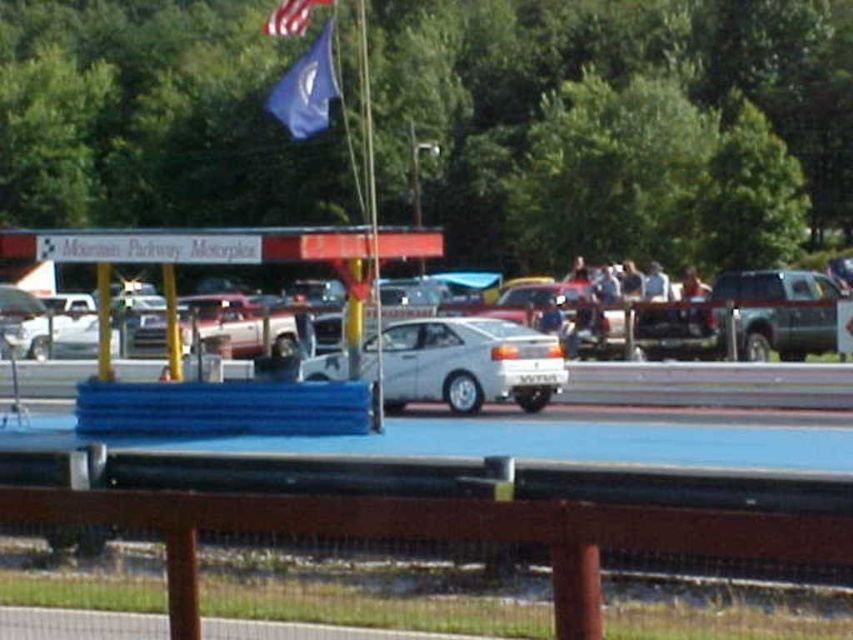
Who is lower down, metallic flag pole at center or american flag at upper center?

Positioned lower is metallic flag pole at center.

The image size is (853, 640). I want to click on metallic flag pole at center, so click(368, 168).

Is point (370, 282) positioned behind point (299, 20)?

No, it is not.

Identify the location of metallic flag pole at center. This screenshot has width=853, height=640. (368, 168).

Who is shorter, white matte sedan at center or american flag at upper center?

white matte sedan at center is shorter.

Between point (367, 364) and point (274, 10), which one is positioned behind?

The point (274, 10) is more distant.

Identify the location of white matte sedan at center. This screenshot has width=853, height=640. (469, 364).

Can you confirm if metallic silver suv at right is taller than american flag at upper center?

No, metallic silver suv at right is not taller than american flag at upper center.

Who is shorter, metallic silver suv at right or american flag at upper center?

Standing shorter between the two is metallic silver suv at right.

Is point (821, 280) farther from camera compared to point (306, 12)?

That is True.

Where is `metallic silver suv at right`? metallic silver suv at right is located at coordinates (784, 332).